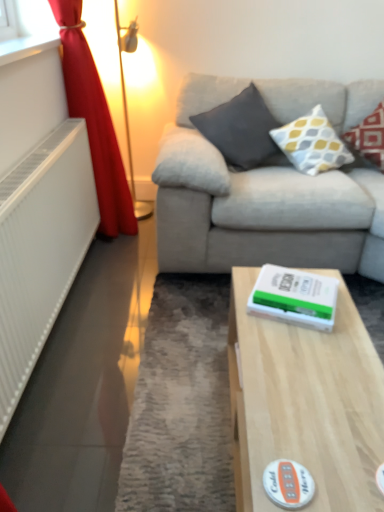
Question: Is light wood table at center oriented away from white textured pillow at upper right, the second pillow viewed from the right?

Choices:
 (A) yes
 (B) no

Answer: (B)

Question: Is light wood table at center not within white textured pillow at upper right, placed as the 2th pillow when sorted from left to right?

Choices:
 (A) no
 (B) yes

Answer: (B)

Question: From a real-world perspective, is light wood table at center physically below white textured pillow at upper right, the second pillow viewed from the right?

Choices:
 (A) no
 (B) yes

Answer: (B)

Question: Considering the relative positions of light wood table at center and white textured pillow at upper right, the second pillow viewed from the right, in the image provided, is light wood table at center to the left of white textured pillow at upper right, the second pillow viewed from the right, from the viewer's perspective?

Choices:
 (A) no
 (B) yes

Answer: (B)

Question: Considering the relative sizes of light wood table at center and white textured pillow at upper right, placed as the 2th pillow when sorted from left to right, in the image provided, is light wood table at center taller than white textured pillow at upper right, placed as the 2th pillow when sorted from left to right,?

Choices:
 (A) yes
 (B) no

Answer: (B)

Question: Considering the positions of metallic gold table lamp at left and red velvet curtain at left in the image, is metallic gold table lamp at left wider or thinner than red velvet curtain at left?

Choices:
 (A) thin
 (B) wide

Answer: (A)

Question: Is metallic gold table lamp at left in front of or behind red velvet curtain at left in the image?

Choices:
 (A) front
 (B) behind

Answer: (B)

Question: Do you think metallic gold table lamp at left is within red velvet curtain at left, or outside of it?

Choices:
 (A) outside
 (B) inside

Answer: (A)

Question: In terms of size, does metallic gold table lamp at left appear bigger or smaller than red velvet curtain at left?

Choices:
 (A) small
 (B) big

Answer: (A)

Question: In terms of width, does red velvet curtain at left look wider or thinner when compared to patterned fabric pillow at upper right, acting as the third pillow starting from the left?

Choices:
 (A) thin
 (B) wide

Answer: (A)

Question: Considering the positions of red velvet curtain at left and patterned fabric pillow at upper right, acting as the third pillow starting from the left, in the image, is red velvet curtain at left bigger or smaller than patterned fabric pillow at upper right, acting as the third pillow starting from the left,?

Choices:
 (A) small
 (B) big

Answer: (B)

Question: Is red velvet curtain at left inside or outside of patterned fabric pillow at upper right, acting as the third pillow starting from the left?

Choices:
 (A) outside
 (B) inside

Answer: (A)

Question: Considering the positions of red velvet curtain at left and patterned fabric pillow at upper right, acting as the third pillow starting from the left, in the image, is red velvet curtain at left taller or shorter than patterned fabric pillow at upper right, acting as the third pillow starting from the left,?

Choices:
 (A) short
 (B) tall

Answer: (B)

Question: From a real-world perspective, is metallic gold table lamp at left physically located above or below dark gray fabric pillow at upper center, positioned as the third pillow in right-to-left order?

Choices:
 (A) above
 (B) below

Answer: (B)

Question: Considering the positions of metallic gold table lamp at left and dark gray fabric pillow at upper center, positioned as the third pillow in right-to-left order, in the image, is metallic gold table lamp at left bigger or smaller than dark gray fabric pillow at upper center, positioned as the third pillow in right-to-left order,?

Choices:
 (A) small
 (B) big

Answer: (B)